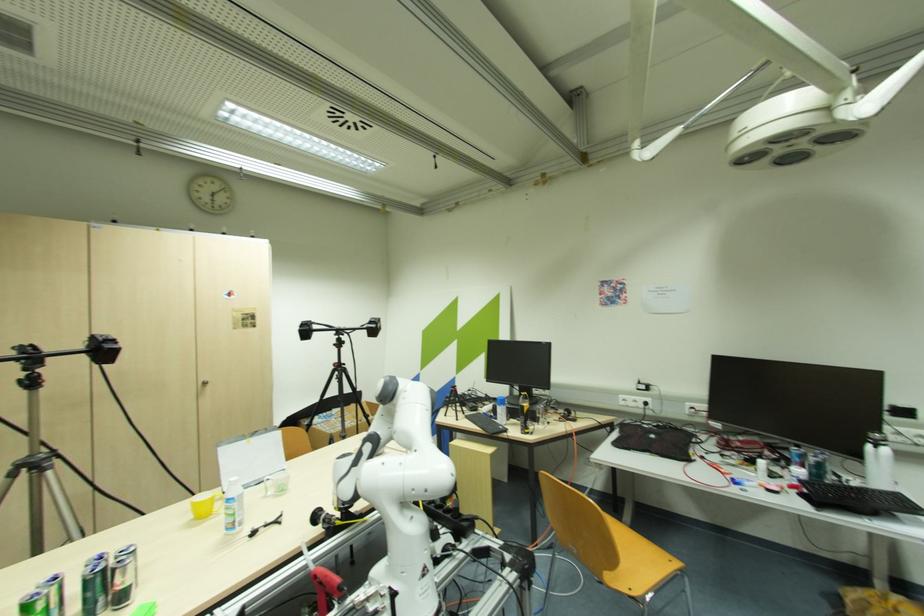
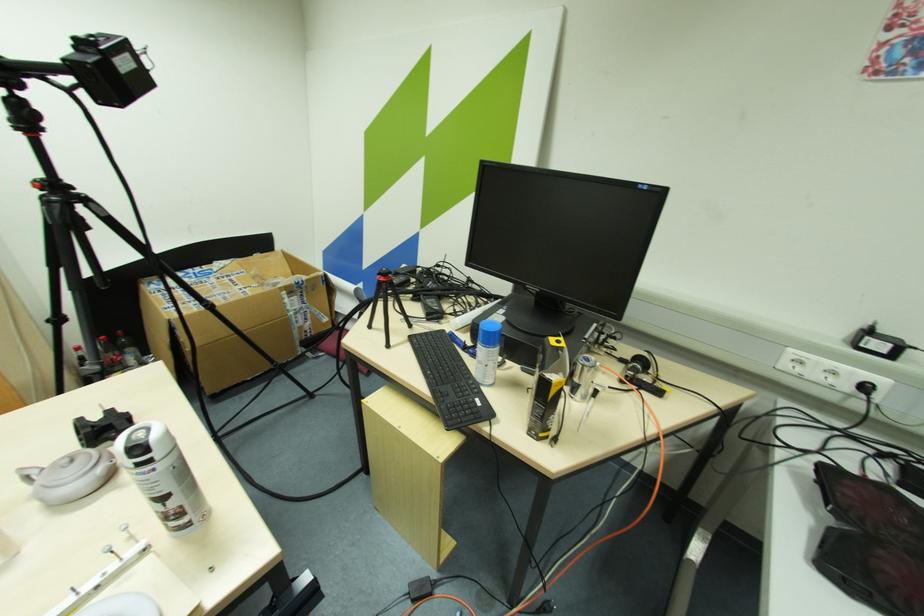
Question: Which direction would the cameraman need to move to produce the second image? Reply with the corresponding letter.

Choices:
 (A) Left
 (B) Right
 (C) Forward
 (D) Backward

Answer: (C)